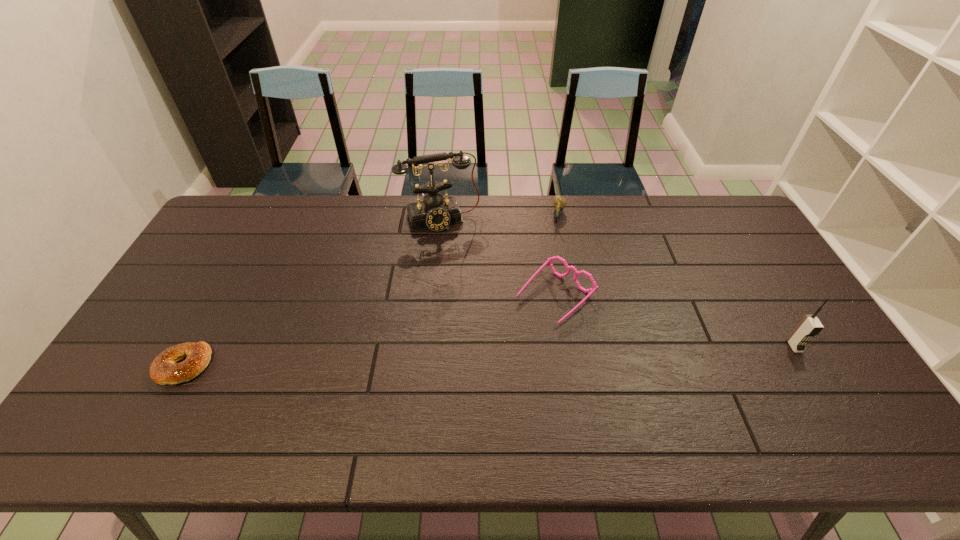
The width and height of the screenshot is (960, 540). What are the coordinates of `vacant space on the desktop that is between the leftmost object and the cellular telephone and is positioned on the arms of the third nearest object` in the screenshot? It's located at (492, 356).

Locate an element on the screen. The height and width of the screenshot is (540, 960). vacant space on the desktop that is between the bagel and the second tallest object and is positioned on the dial of the telephone is located at coordinates (490, 356).

This screenshot has height=540, width=960. Find the location of `free space on the desktop that is between the bagel and the second tallest object and is positioned on the front-facing side of the second shortest object`. free space on the desktop that is between the bagel and the second tallest object and is positioned on the front-facing side of the second shortest object is located at coordinates (528, 355).